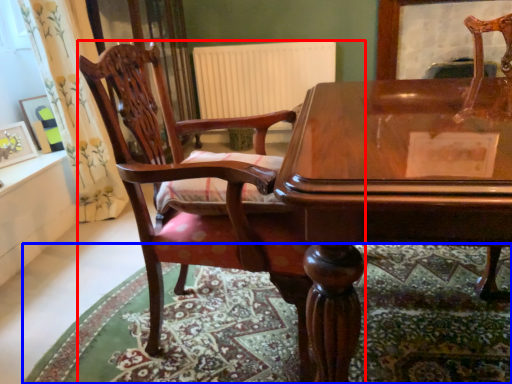
Question: Which of the following is the closest to the observer, chair (highlighted by a red box) or mat (highlighted by a blue box)?

Choices:
 (A) chair
 (B) mat

Answer: (A)